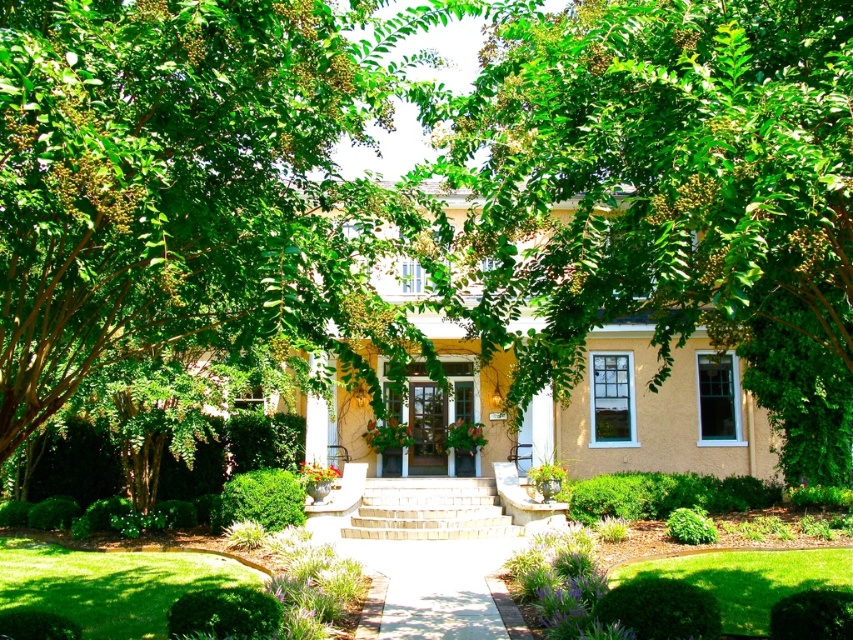
Question: Which object is the farthest from the green grass at lower left?

Choices:
 (A) green leafy tree at upper left
 (B) smooth concrete path at center
 (C) green grass at lower right
 (D) green leafy tree at center

Answer: (D)

Question: Does green leafy tree at center have a smaller size compared to green grass at lower right?

Choices:
 (A) yes
 (B) no

Answer: (B)

Question: Does green leafy tree at center appear over green grass at lower left?

Choices:
 (A) no
 (B) yes

Answer: (B)

Question: Which of the following is the closest to the observer?

Choices:
 (A) (48, 589)
 (B) (490, 624)
 (C) (6, 307)
 (D) (775, 580)

Answer: (C)

Question: Estimate the real-world distances between objects in this image. Which object is closer to the green grass at lower left?

Choices:
 (A) green grass at lower right
 (B) green leafy tree at center
 (C) green leafy tree at upper left

Answer: (C)

Question: Where is green grass at lower left located in relation to green grass at lower right in the image?

Choices:
 (A) left
 (B) right

Answer: (A)